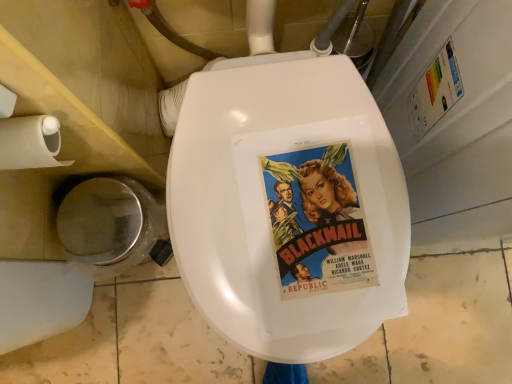
I want to click on vacant area on top of shiny metallic trash can at lower left (from a real-world perspective), so click(94, 225).